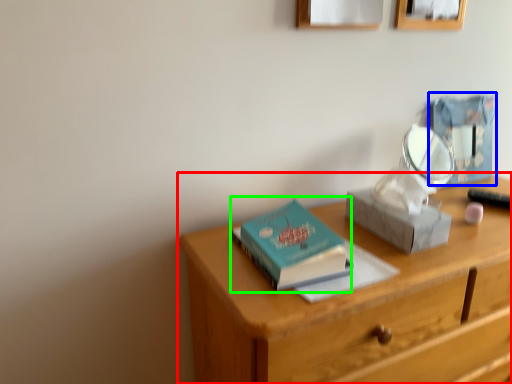
Question: Based on their relative distances, which object is farther from desk (highlighted by a red box)? Choose from box (highlighted by a blue box) and paperback book (highlighted by a green box).

Choices:
 (A) box
 (B) paperback book

Answer: (A)